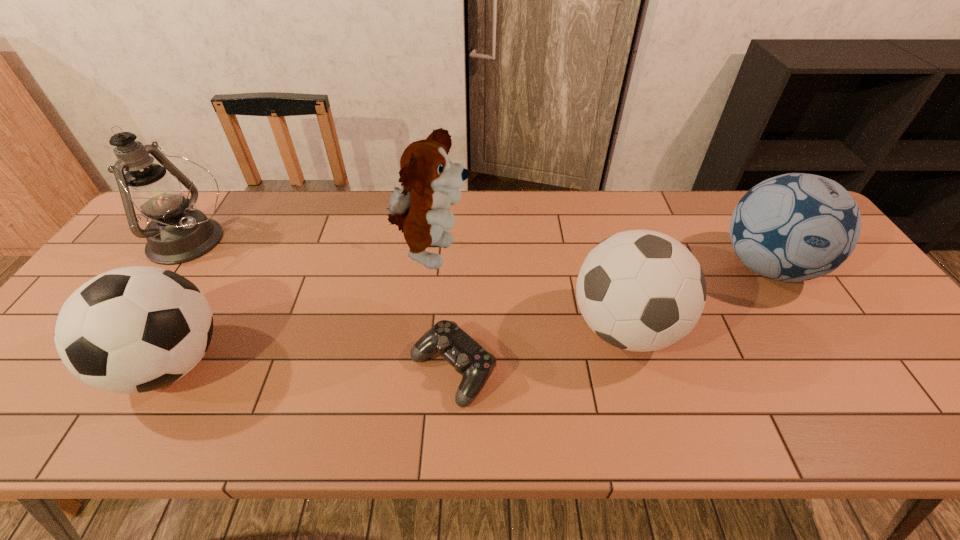
This screenshot has width=960, height=540. Find the location of `the third closest object relative to the oil lamp`. the third closest object relative to the oil lamp is located at coordinates (475, 364).

Locate an element on the screen. Image resolution: width=960 pixels, height=540 pixels. object that ranks as the third closest to the puppy is located at coordinates (136, 329).

Identify which soccer ball is the second closest to the rightmost soccer ball. Please provide its 2D coordinates. Your answer should be formatted as a tuple, i.e. [(x, y)], where the tuple contains the x and y coordinates of a point satisfying the conditions above.

[(136, 329)]

The width and height of the screenshot is (960, 540). Identify the location of soccer ball that is the second closest to the leftmost soccer ball. (794, 227).

At what (x,y) coordinates should I click in order to perform the action: click on free space that satisfies the following two spatial constraints: 1. on the face of the fifth object from left to right; 2. on the right side of the puppy. Please return your answer as a coordinate pair (x, y). This screenshot has width=960, height=540. Looking at the image, I should click on (421, 328).

Where is `vacant point that satisfies the following two spatial constraints: 1. on the face of the puppy; 2. on the right side of the second soccer ball from right to left`? Image resolution: width=960 pixels, height=540 pixels. vacant point that satisfies the following two spatial constraints: 1. on the face of the puppy; 2. on the right side of the second soccer ball from right to left is located at coordinates (421, 328).

You are a GUI agent. You are given a task and a screenshot of the screen. Output one action in this format:
    pyautogui.click(x=<x>, y=<y>)
    Task: Click on the vacant space that satisfies the following two spatial constraints: 1. on the face of the puppy; 2. on the back side of the control
    This screenshot has width=960, height=540.
    Given the screenshot: What is the action you would take?
    pyautogui.click(x=417, y=370)

Locate an element on the screen. vacant space that satisfies the following two spatial constraints: 1. on the face of the second object from right to left; 2. on the left side of the puppy is located at coordinates (421, 328).